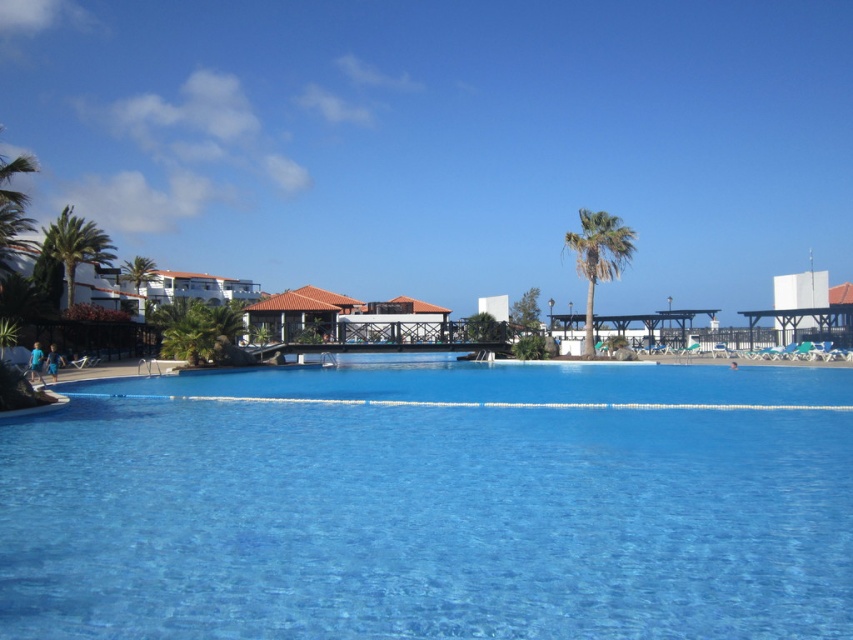
Who is more forward, (206, 452) or (84, 237)?

Point (206, 452) is more forward.

Can you confirm if transparent glass pool at center is positioned above green leafy palm tree at left?

No, transparent glass pool at center is not above green leafy palm tree at left.

Identify the location of transparent glass pool at center. The height and width of the screenshot is (640, 853). (434, 506).

Does transparent glass pool at center have a lesser width compared to green leafy palm tree at center?

Incorrect, transparent glass pool at center's width is not less than green leafy palm tree at center's.

Which of these two, transparent glass pool at center or green leafy palm tree at center, stands taller?

green leafy palm tree at center is taller.

Is point (381, 444) positioned after point (567, 236)?

No, (381, 444) is closer to viewer.

Locate an element on the screen. transparent glass pool at center is located at coordinates (434, 506).

Is point (618, 234) farther from camera compared to point (67, 280)?

No, (618, 234) is closer to viewer.

Who is more distant from viewer, [611,230] or [51,250]?

The point [51,250] is behind.

The width and height of the screenshot is (853, 640). Identify the location of green leafy palm tree at center. (598, 257).